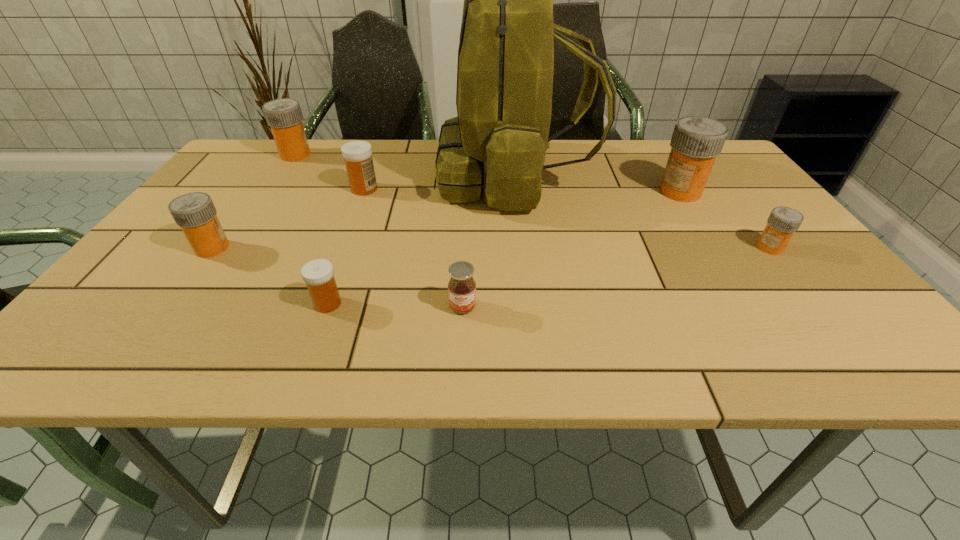
I want to click on free space located 0.320m on the front of the farther white medicine, so click(330, 279).

Image resolution: width=960 pixels, height=540 pixels. Find the location of `free space located 0.110m on the label side of the jam`. free space located 0.110m on the label side of the jam is located at coordinates (461, 364).

The width and height of the screenshot is (960, 540). I want to click on free space located on the label side of the rightmost orange medicine, so click(x=613, y=248).

The height and width of the screenshot is (540, 960). I want to click on vacant space located on the label side of the rightmost orange medicine, so click(712, 248).

Identify the location of vacant area situated 0.070m on the label side of the rightmost orange medicine. The image size is (960, 540). (726, 248).

You are a GUI agent. You are given a task and a screenshot of the screen. Output one action in this format:
    pyautogui.click(x=<x>, y=<y>)
    Task: Click on the vacant region located on the right of the nearer white medicine
    The height and width of the screenshot is (540, 960).
    Given the screenshot: What is the action you would take?
    pyautogui.click(x=445, y=303)

Where is `backpack positioned at the far edge`? The width and height of the screenshot is (960, 540). backpack positioned at the far edge is located at coordinates (506, 51).

Where is `medicine that is at the far edge`? This screenshot has height=540, width=960. medicine that is at the far edge is located at coordinates (284, 116).

Locate an element on the screen. The height and width of the screenshot is (540, 960). object that is at the far left corner is located at coordinates (284, 116).

Locate an element on the screen. This screenshot has height=540, width=960. blank space at the far edge is located at coordinates (395, 162).